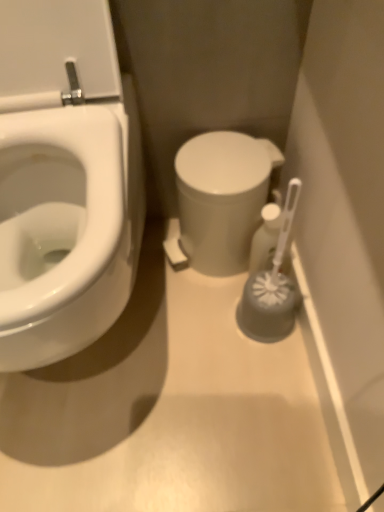
Question: Can we say white plastic toilet brush at right lies outside white glossy bidet at left?

Choices:
 (A) yes
 (B) no

Answer: (A)

Question: Is white plastic toilet brush at right thinner than white glossy bidet at left?

Choices:
 (A) yes
 (B) no

Answer: (A)

Question: From the image's perspective, does white plastic toilet brush at right appear higher than white glossy bidet at left?

Choices:
 (A) no
 (B) yes

Answer: (A)

Question: Can you confirm if white plastic toilet brush at right is positioned to the right of white glossy bidet at left?

Choices:
 (A) no
 (B) yes

Answer: (B)

Question: From a real-world perspective, does white plastic toilet brush at right sit lower than white glossy bidet at left?

Choices:
 (A) no
 (B) yes

Answer: (B)

Question: From a real-world perspective, is white glossy bidet at left positioned above or below white glossy toilet at center?

Choices:
 (A) above
 (B) below

Answer: (A)

Question: Is point (8, 188) closer or farther from the camera than point (248, 206)?

Choices:
 (A) farther
 (B) closer

Answer: (B)

Question: Which is correct: white glossy bidet at left is inside white glossy toilet at center, or outside of it?

Choices:
 (A) outside
 (B) inside

Answer: (A)

Question: In terms of size, does white glossy bidet at left appear bigger or smaller than white glossy toilet at center?

Choices:
 (A) small
 (B) big

Answer: (B)

Question: Is point (264, 245) positioned closer to the camera than point (273, 311)?

Choices:
 (A) farther
 (B) closer

Answer: (A)

Question: From the image's perspective, is white plastic toilet brush at right above or below gray rubber brush at right?

Choices:
 (A) above
 (B) below

Answer: (A)

Question: Considering their positions, is white plastic toilet brush at right located in front of or behind gray rubber brush at right?

Choices:
 (A) front
 (B) behind

Answer: (B)

Question: In the image, is white plastic toilet brush at right on the left side or the right side of gray rubber brush at right?

Choices:
 (A) left
 (B) right

Answer: (B)

Question: Considering the relative positions of gray rubber brush at right and white glossy toilet at center in the image provided, is gray rubber brush at right to the left or to the right of white glossy toilet at center?

Choices:
 (A) left
 (B) right

Answer: (B)

Question: Considering the positions of gray rubber brush at right and white glossy toilet at center in the image, is gray rubber brush at right bigger or smaller than white glossy toilet at center?

Choices:
 (A) small
 (B) big

Answer: (A)